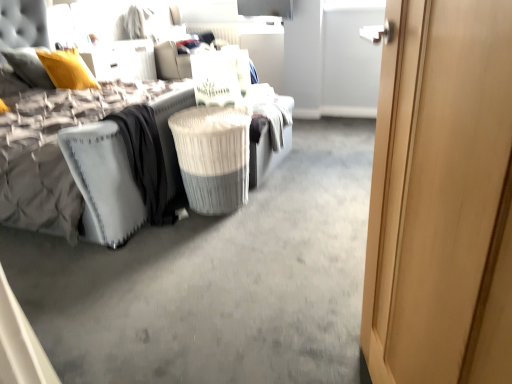
Question: Does white wicker laundry basket at center have a smaller size compared to velvet grey bed at center?

Choices:
 (A) no
 (B) yes

Answer: (B)

Question: Are white wicker laundry basket at center and velvet grey bed at center far apart?

Choices:
 (A) no
 (B) yes

Answer: (A)

Question: From a real-world perspective, does white wicker laundry basket at center stand above velvet grey bed at center?

Choices:
 (A) no
 (B) yes

Answer: (A)

Question: Is velvet grey bed at center a part of white wicker laundry basket at center?

Choices:
 (A) yes
 (B) no

Answer: (B)

Question: Is white wicker laundry basket at center in front of velvet grey bed at center?

Choices:
 (A) yes
 (B) no

Answer: (B)

Question: From the image's perspective, is white wicker laundry basket at center below velvet grey bed at center?

Choices:
 (A) yes
 (B) no

Answer: (A)

Question: Does light wood door at right have a larger size compared to white textured mattress at left?

Choices:
 (A) no
 (B) yes

Answer: (A)

Question: Is the depth of light wood door at right less than that of white textured mattress at left?

Choices:
 (A) no
 (B) yes

Answer: (B)

Question: Is light wood door at right next to white textured mattress at left and touching it?

Choices:
 (A) no
 (B) yes

Answer: (A)

Question: Is light wood door at right outside of white textured mattress at left?

Choices:
 (A) yes
 (B) no

Answer: (A)

Question: From a real-world perspective, is light wood door at right below white textured mattress at left?

Choices:
 (A) yes
 (B) no

Answer: (B)

Question: From the image's perspective, would you say light wood door at right is positioned over white textured mattress at left?

Choices:
 (A) no
 (B) yes

Answer: (A)

Question: Is white textured mattress at left smaller than velvet grey bed at center?

Choices:
 (A) no
 (B) yes

Answer: (B)